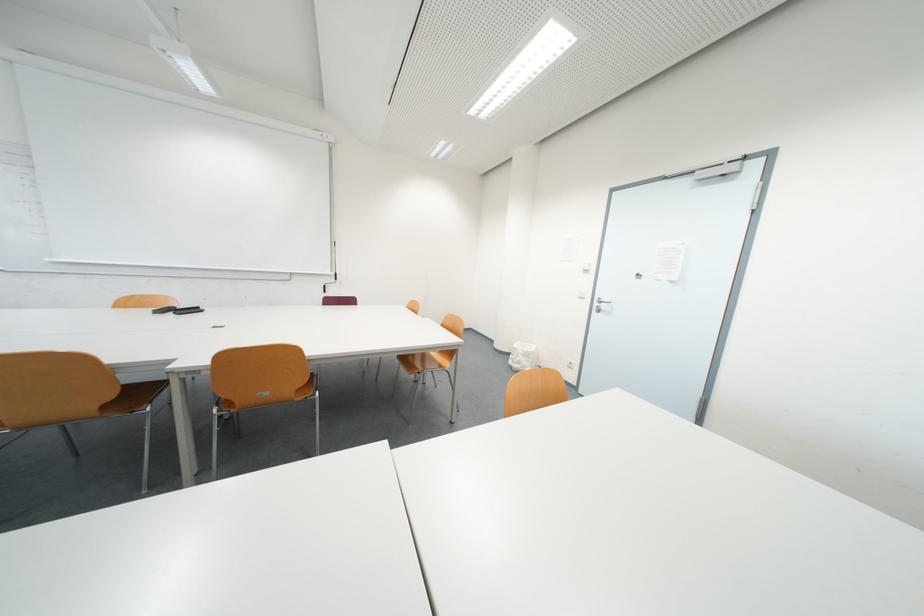
I want to click on silver door handle, so click(x=602, y=305).